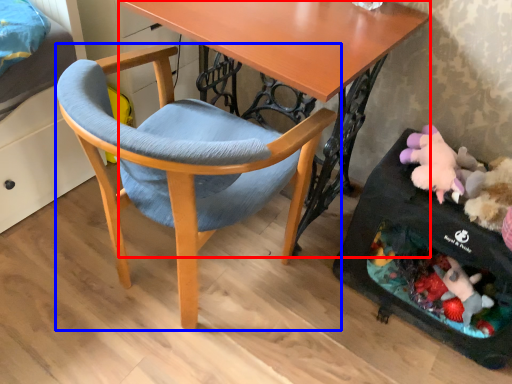
Question: Among these objects, which one is nearest to the camera, desk (highlighted by a red box) or chair (highlighted by a blue box)?

Choices:
 (A) desk
 (B) chair

Answer: (B)